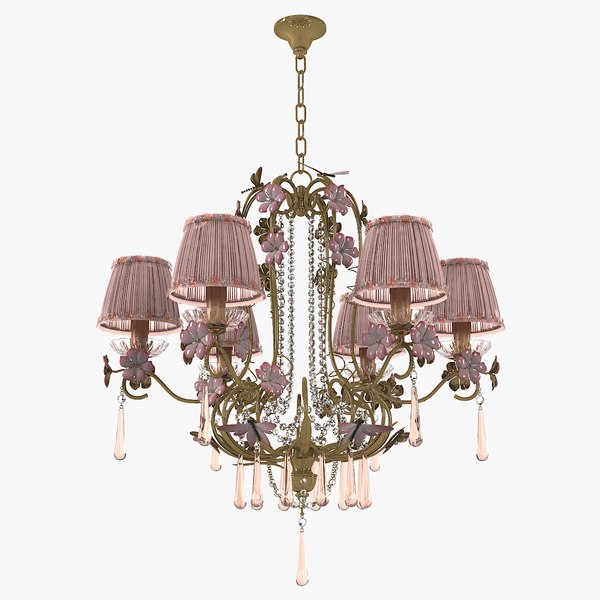
The image size is (600, 600). Find the location of `top of lamp shade`. top of lamp shade is located at coordinates (209, 215), (150, 257), (412, 216), (459, 257).